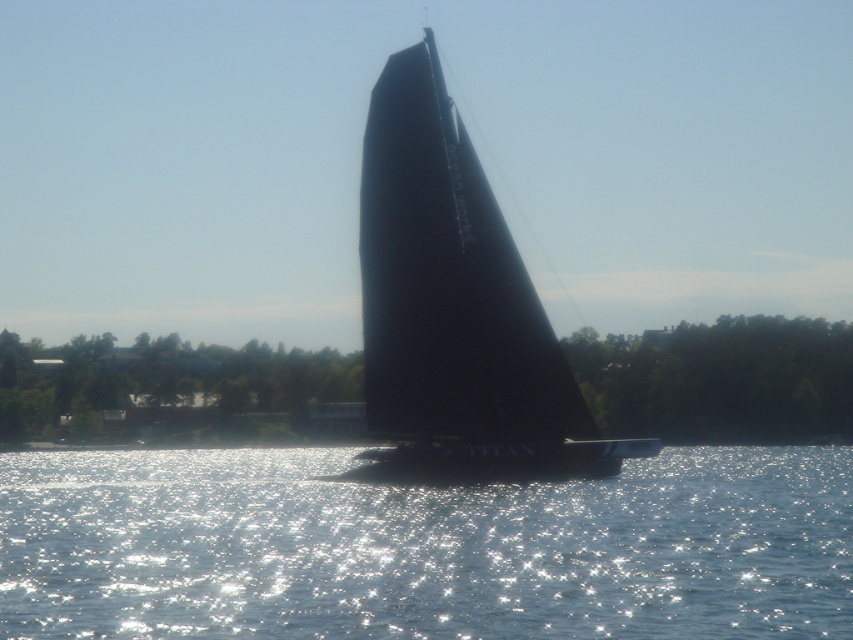
Question: Among these points, which one is farthest from the camera?

Choices:
 (A) (474, 371)
 (B) (173, 467)

Answer: (B)

Question: Is sparkling water at center smaller than black matte sailboat at center?

Choices:
 (A) yes
 (B) no

Answer: (B)

Question: Which point is farther from the camera taking this photo?

Choices:
 (A) click(x=838, y=595)
 (B) click(x=442, y=406)

Answer: (B)

Question: Which point appears farthest from the camera in this image?

Choices:
 (A) (393, 65)
 (B) (840, 582)

Answer: (A)

Question: In this image, where is sparkling water at center located relative to black matte sailboat at center?

Choices:
 (A) above
 (B) below

Answer: (B)

Question: Is sparkling water at center smaller than black matte sailboat at center?

Choices:
 (A) no
 (B) yes

Answer: (A)